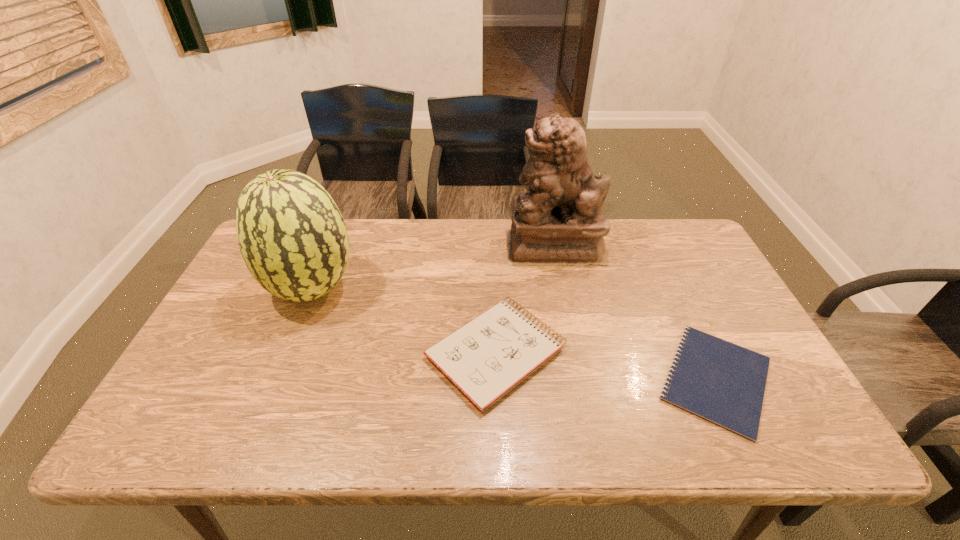
Where is `blank space at the near edge of the desktop`? blank space at the near edge of the desktop is located at coordinates (681, 411).

You are a GUI agent. You are given a task and a screenshot of the screen. Output one action in this format:
    pyautogui.click(x=<x>, y=<y>)
    Task: Click on the vacant space at the left edge of the desktop
    The image size is (960, 540).
    Given the screenshot: What is the action you would take?
    pyautogui.click(x=257, y=317)

The image size is (960, 540). I want to click on unoccupied position between the taller notepad and the shorter notepad, so click(x=606, y=366).

The height and width of the screenshot is (540, 960). I want to click on free space between the sculpture and the leftmost object, so click(433, 267).

This screenshot has width=960, height=540. What are the coordinates of `free spot between the left notepad and the leftmost object` in the screenshot? It's located at (404, 321).

This screenshot has width=960, height=540. In order to click on unoccupied area between the sculpture and the shorter notepad in this screenshot , I will do `click(635, 313)`.

Image resolution: width=960 pixels, height=540 pixels. What are the coordinates of `vacant point located between the sculpture and the second shortest object` in the screenshot? It's located at (525, 300).

This screenshot has width=960, height=540. I want to click on vacant area that lies between the third tallest object and the third shortest object, so click(x=404, y=321).

Find the location of a particular element. This screenshot has height=540, width=960. blank region between the left notepad and the second tallest object is located at coordinates (404, 321).

This screenshot has width=960, height=540. What are the coordinates of `free space that is in between the taller notepad and the sculpture` in the screenshot? It's located at 525,300.